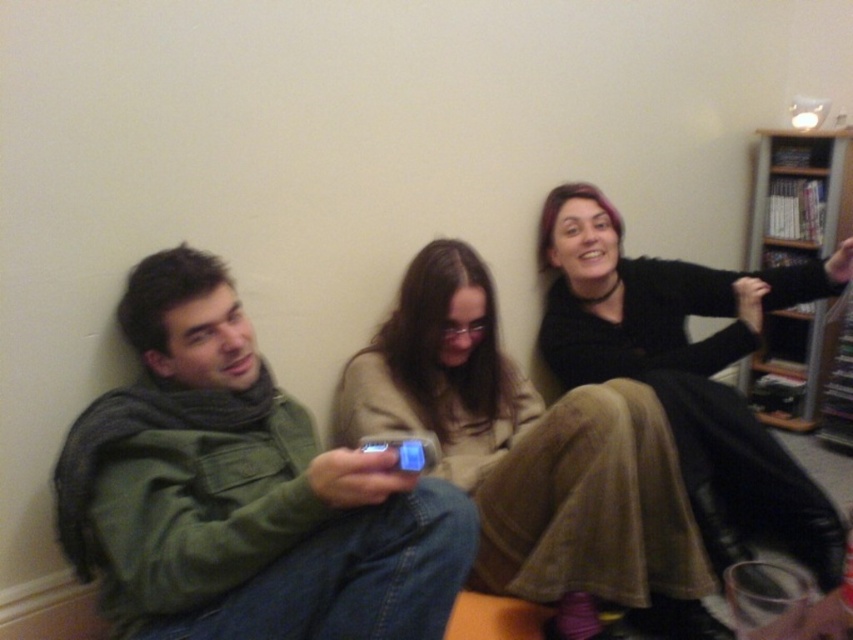
You are a fashion designer observing the image. You need to determine if the green matte jacket at center can be worn over the matte beige pants at center. Based on the scene description, can you confirm if this is possible?

The green matte jacket at center is positioned over matte beige pants at center in the image, so yes, it is possible to wear the green matte jacket at center over the matte beige pants at center.

In the scene described, where is the green matte jacket at center positioned relative to the matte beige pants at center?

The green matte jacket at center is to the left of the matte beige pants at center.

You are an interior designer trying to arrange furniture in the room shown. You have a new sofa that is 1.5 meters wide. The green matte jacket at center and the wooden bookshelf at upper right are already in the room. Can the sofa be placed between them without overlapping?

The green matte jacket at center is wider than the wooden bookshelf at upper right. However, since the jacket is an item of clothing worn by a person and not a fixed object, its width may not be a reliable measurement for furniture placement. Therefore, it is uncertain whether the sofa can fit between them without overlapping.